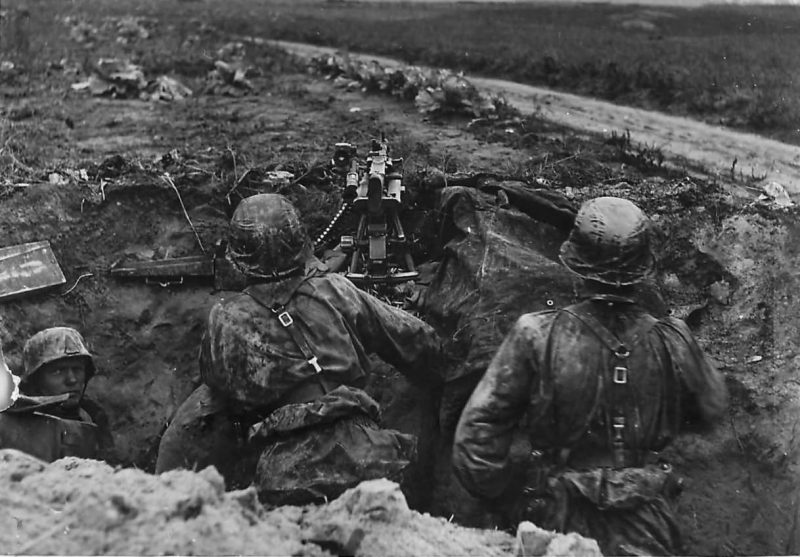
Identify the location of box. The height and width of the screenshot is (557, 800). (24, 263).